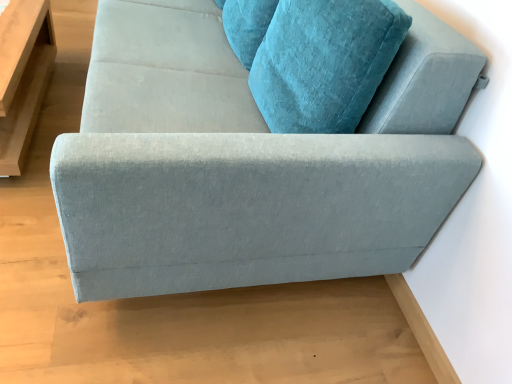
Question: From the image's perspective, is light brown wooden table at left positioned above or below matte gray couch at center?

Choices:
 (A) above
 (B) below

Answer: (B)

Question: From a real-world perspective, is light brown wooden table at left positioned above or below matte gray couch at center?

Choices:
 (A) above
 (B) below

Answer: (B)

Question: Based on their sizes in the image, would you say light brown wooden table at left is bigger or smaller than matte gray couch at center?

Choices:
 (A) small
 (B) big

Answer: (A)

Question: Would you say matte gray couch at center is to the left or to the right of light brown wooden table at left in the picture?

Choices:
 (A) left
 (B) right

Answer: (B)

Question: Is point (163, 246) closer or farther from the camera than point (26, 23)?

Choices:
 (A) farther
 (B) closer

Answer: (B)

Question: Is matte gray couch at center in front of or behind light brown wooden table at left in the image?

Choices:
 (A) front
 (B) behind

Answer: (A)

Question: From the image's perspective, relative to light brown wooden table at left, is matte gray couch at center above or below?

Choices:
 (A) below
 (B) above

Answer: (B)